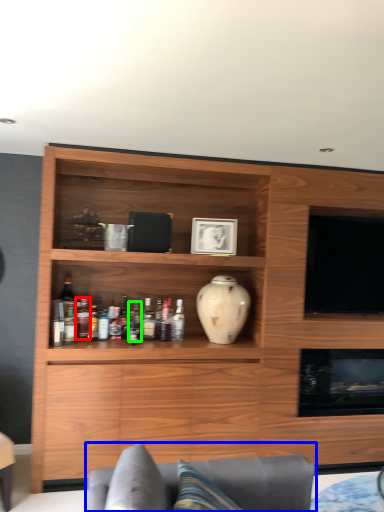
Question: Which object is the farthest from bottle (highlighted by a red box)? Choose among these: studio couch (highlighted by a blue box) or bottle (highlighted by a green box).

Choices:
 (A) studio couch
 (B) bottle

Answer: (A)